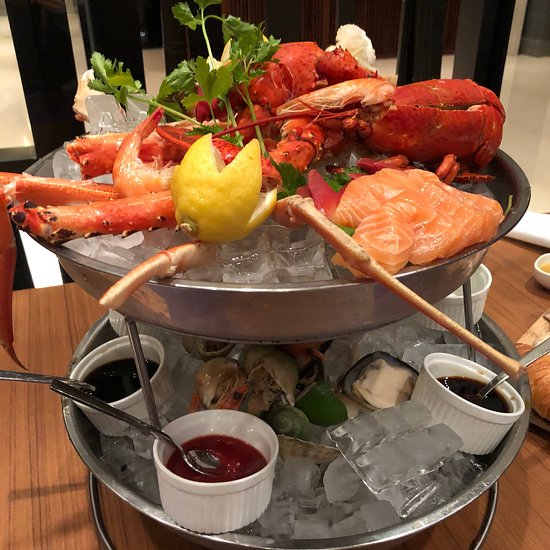
Where is `bowls`? This screenshot has height=550, width=550. bowls is located at coordinates (234, 513), (137, 402), (268, 298), (466, 419), (478, 304), (544, 280), (458, 503).